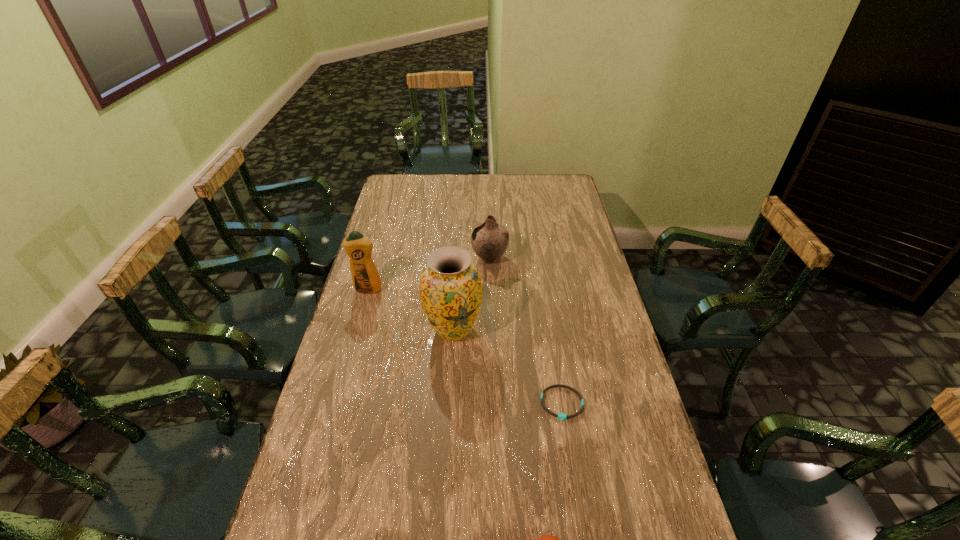
This screenshot has width=960, height=540. What are the coordinates of `vacant space situated 0.150m from the spout of the farthest object` in the screenshot? It's located at (433, 258).

Find the location of a particular element. This screenshot has width=960, height=540. free space located 0.320m from the spout of the farthest object is located at coordinates (390, 258).

The height and width of the screenshot is (540, 960). Identify the location of vacant region located 0.230m on the buckle of the wristband. (579, 510).

Identify the location of object present at the left edge. (365, 276).

Identify the location of blank area at the far edge. The height and width of the screenshot is (540, 960). (515, 195).

This screenshot has width=960, height=540. Find the location of `vacant region at the left edge of the desktop`. vacant region at the left edge of the desktop is located at coordinates (350, 336).

Identify the location of vacant point at the right edge. The width and height of the screenshot is (960, 540). pyautogui.click(x=600, y=269).

This screenshot has height=540, width=960. In the image, there is a desktop. Find the location of `vacant space at the far left corner`. vacant space at the far left corner is located at coordinates (397, 191).

Where is `vacant space that is in between the third tallest object and the wristband`? Image resolution: width=960 pixels, height=540 pixels. vacant space that is in between the third tallest object and the wristband is located at coordinates (526, 331).

This screenshot has height=540, width=960. What are the coordinates of `vacant area that lies between the third shortest object and the wristband` in the screenshot? It's located at click(526, 331).